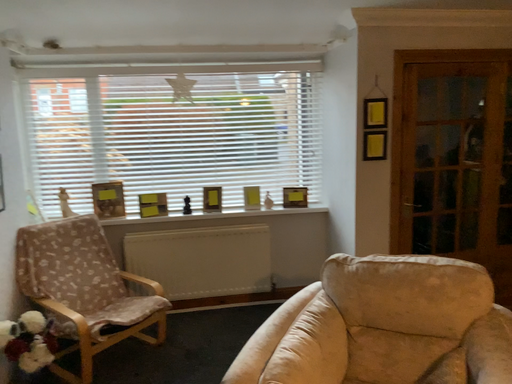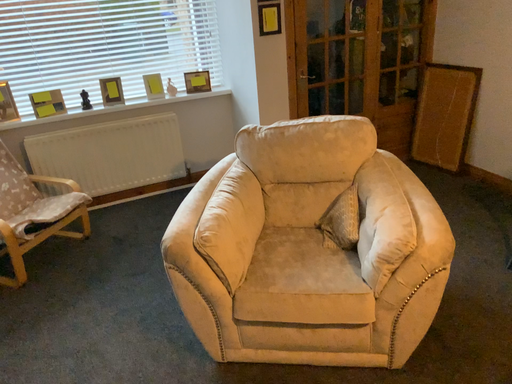
Question: Which way did the camera rotate in the video?

Choices:
 (A) rotated right
 (B) rotated left

Answer: (A)